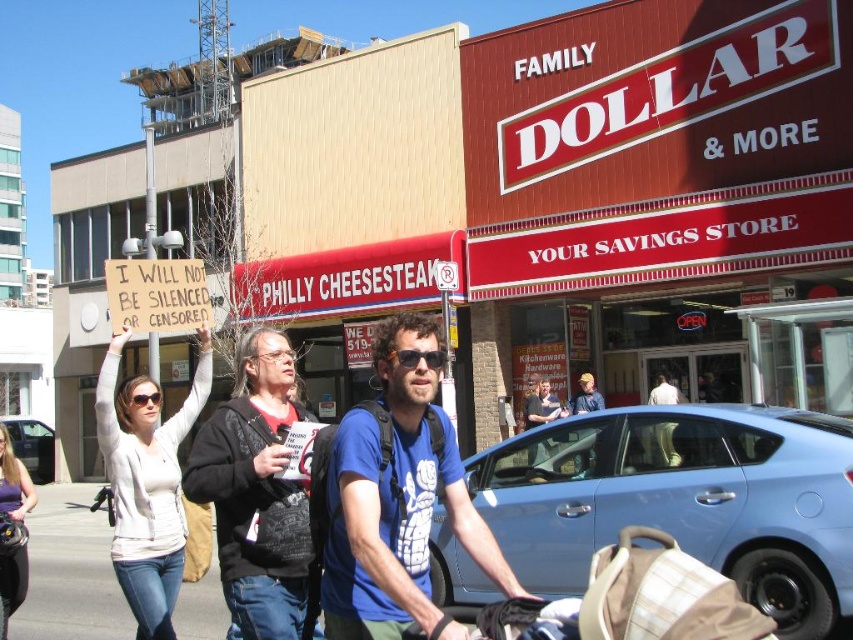
You are a photographer trying to capture a photo of the white sweater at center and the white cotton shirt at center from the side of the Family Dollar store. Which clothing item would you need to adjust your camera angle to include in the frame first if they are partially overlapping?

The white sweater at center might be wider than the white cotton shirt at center, so you might need to adjust your camera angle to include the white sweater at center first to ensure it is fully visible in the frame.

You are a delivery person trying to navigate through the street scene. You need to pass between the blue matte car at lower right and the plaid fabric baby carriage at lower center. Can your delivery van, which is 1.8 meters wide, fit through the space between them?

The blue matte car at lower right is wider than the plaid fabric baby carriage at lower center. However, the exact width of the space between them isn

Looking at this image, you are a delivery person who needs to deliver a package to the Family Dollar store. You are standing at the blue matte car at lower right and the plaid fabric baby carriage at lower center. Which object is closer to the store?

The plaid fabric baby carriage at lower center is closer to the Family Dollar store because the distance between the blue matte car at lower right and the plaid fabric baby carriage at lower center is 6.81 meters, implying the baby carriage is nearer to the store.